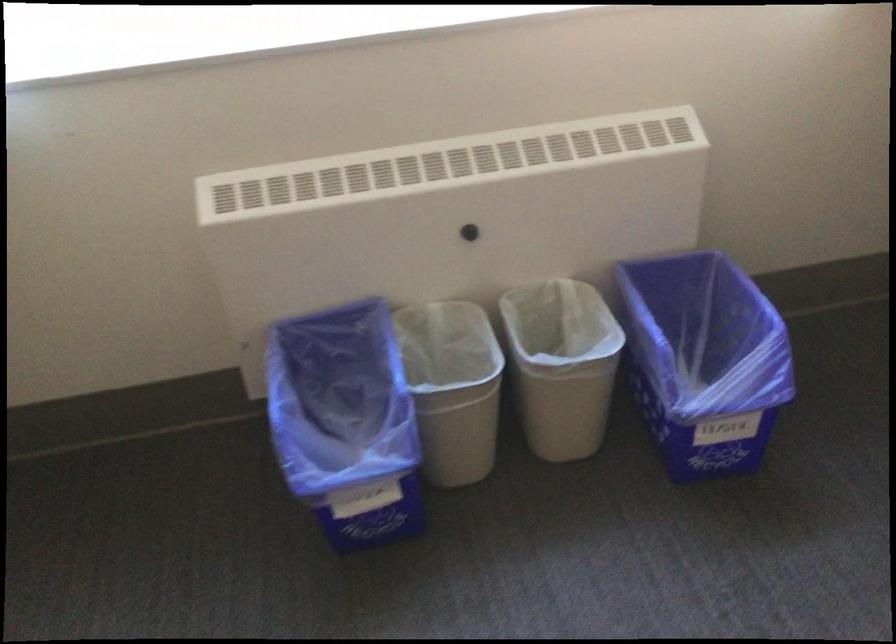
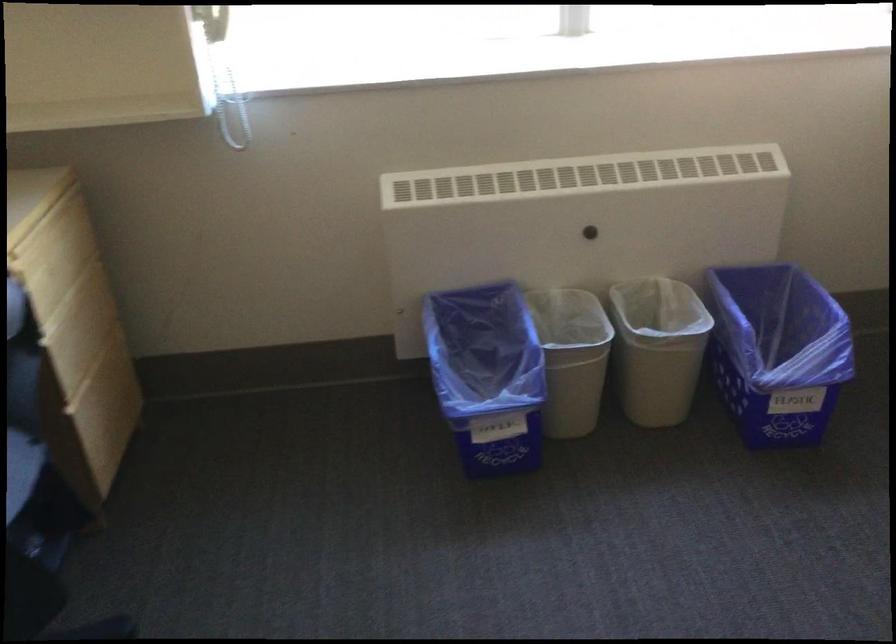
Find the pixel in the second image that matches [701,355] in the first image.

(777, 352)